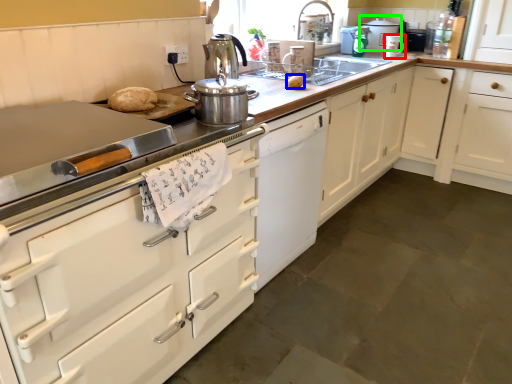
Question: Estimate the real-world distances between objects in this image. Which object is farther from kitchen appliance (highlighted by a red box), food (highlighted by a blue box) or kitchen appliance (highlighted by a green box)?

Choices:
 (A) food
 (B) kitchen appliance

Answer: (A)